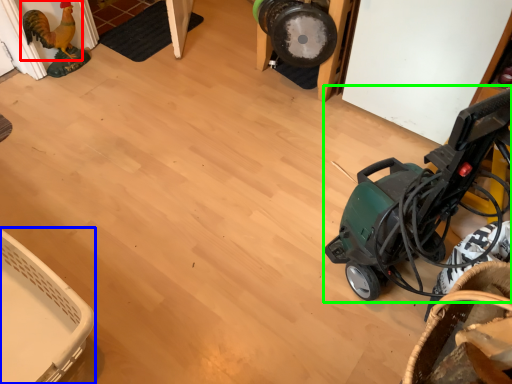
Question: Based on their relative distances, which object is farther from chicken (highlighted by a red box)? Choose from basket (highlighted by a blue box) and baby carriage (highlighted by a green box).

Choices:
 (A) basket
 (B) baby carriage

Answer: (B)